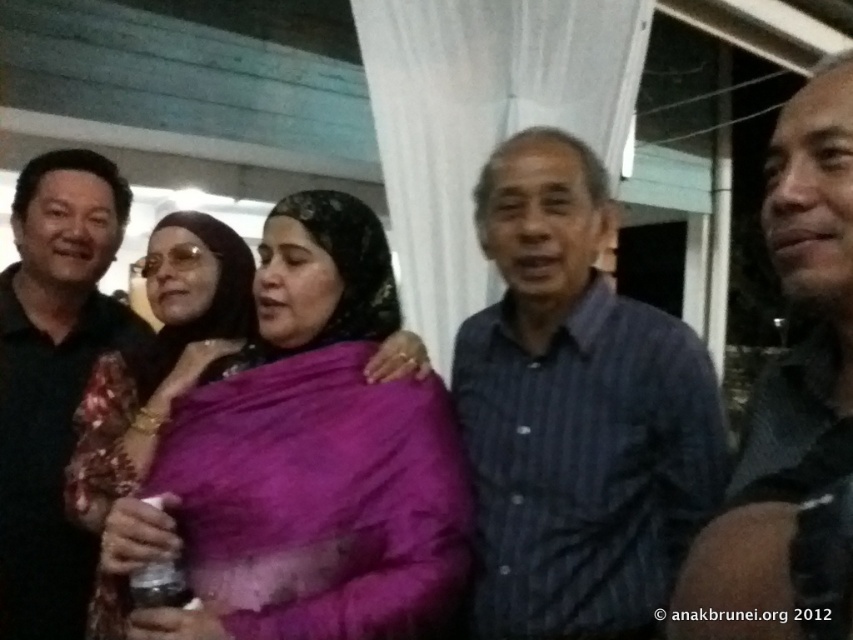
Question: Which point is closer to the camera?

Choices:
 (A) (49, 227)
 (B) (778, 266)

Answer: (B)

Question: Considering the relative positions of smooth skin face at center and black matte shirt at left in the image provided, where is smooth skin face at center located with respect to black matte shirt at left?

Choices:
 (A) above
 (B) below

Answer: (A)

Question: Which object appears farthest from the camera in this image?

Choices:
 (A) purple silk saree at center
 (B) blue striped shirt at center
 (C) black matte shirt at left

Answer: (C)

Question: Which object is the farthest from the blue striped shirt at center?

Choices:
 (A) black matte shirt at left
 (B) purple silk saree at center
 (C) smooth skin face at center

Answer: (A)

Question: Can you confirm if blue striped shirt at center is smaller than purple silk saree at center?

Choices:
 (A) no
 (B) yes

Answer: (A)

Question: Is blue striped shirt at center wider than black matte shirt at left?

Choices:
 (A) no
 (B) yes

Answer: (B)